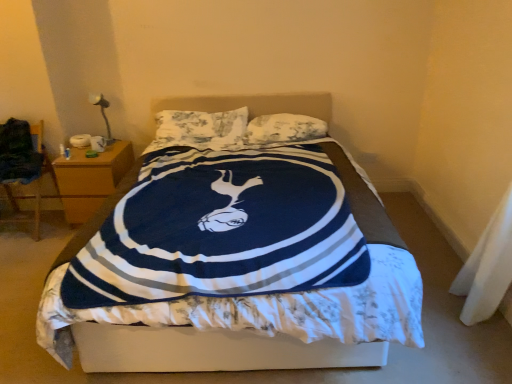
Image resolution: width=512 pixels, height=384 pixels. Identify the location of white fabric at lower right. (487, 267).

Describe the element at coordinates (186, 340) in the screenshot. I see `navy blue plush blanket at center` at that location.

Measure the distance between navy blue plush blanket at center and camera.

navy blue plush blanket at center and camera are 5.38 feet apart from each other.

Locate an element on the screen. metallic silver table lamp at upper left is located at coordinates (102, 113).

Image resolution: width=512 pixels, height=384 pixels. Identify the location of white fabric at lower right. (487, 267).

Is fluffy white pillow at center, which ranks as the second pillow in left-to-right order, in front of fluffy white pillow at center, the second pillow viewed from the right?

No, fluffy white pillow at center, which ranks as the second pillow in left-to-right order, is further to the viewer.

Considering the sizes of objects fluffy white pillow at center, which is the 1th pillow in right-to-left order, and fluffy white pillow at center, placed as the first pillow when sorted from left to right, in the image provided, who is taller, fluffy white pillow at center, which is the 1th pillow in right-to-left order, or fluffy white pillow at center, placed as the first pillow when sorted from left to right,?

fluffy white pillow at center, placed as the first pillow when sorted from left to right, is taller.

Can you confirm if fluffy white pillow at center, which ranks as the second pillow in left-to-right order, is bigger than fluffy white pillow at center, the second pillow viewed from the right?

No.

Does fluffy white pillow at center, which is the 1th pillow in right-to-left order, touch fluffy white pillow at center, placed as the first pillow when sorted from left to right?

No, fluffy white pillow at center, which is the 1th pillow in right-to-left order, is not beside fluffy white pillow at center, placed as the first pillow when sorted from left to right.

Considering the sizes of objects wooden nightstand at left and navy blue plush blanket at center in the image provided, who is thinner, wooden nightstand at left or navy blue plush blanket at center?

Thinner between the two is wooden nightstand at left.

Find the location of a particular element. nightstand that appears above the navy blue plush blanket at center (from the image's perspective) is located at coordinates (90, 179).

Are wooden nightstand at left and navy blue plush blanket at center located far from each other?

Absolutely, wooden nightstand at left is distant from navy blue plush blanket at center.

How many degrees apart are the facing directions of wooden nightstand at left and navy blue plush blanket at center?

They differ by 1.37 degrees in their facing directions.

Locate an element on the screen. The width and height of the screenshot is (512, 384). material that appears below the wooden chair at left (from a real-world perspective) is located at coordinates (487, 267).

From the picture: Is white fabric at lower right outside of wooden chair at left?

Yes, white fabric at lower right is outside of wooden chair at left.

From a real-world perspective, relative to wooden chair at left, is white fabric at lower right vertically above or below?

white fabric at lower right is situated lower than wooden chair at left in the real world.

Can you confirm if white fabric at lower right is positioned to the left of wooden chair at left?

In fact, white fabric at lower right is to the right of wooden chair at left.

Between metallic silver table lamp at upper left and navy blue plush blanket at center, which one appears on the left side from the viewer's perspective?

From the viewer's perspective, metallic silver table lamp at upper left appears more on the left side.

Which of these two, metallic silver table lamp at upper left or navy blue plush blanket at center, is bigger?

Bigger between the two is navy blue plush blanket at center.

Is metallic silver table lamp at upper left positioned with its back to navy blue plush blanket at center?

No, metallic silver table lamp at upper left is not facing away from navy blue plush blanket at center.

From a real-world perspective, is metallic silver table lamp at upper left under navy blue plush blanket at center?

No, from a real-world perspective, metallic silver table lamp at upper left is not below navy blue plush blanket at center.

From a real-world perspective, who is located lower, navy blue plush blanket at center or fluffy white pillow at center, which ranks as the second pillow in left-to-right order?

navy blue plush blanket at center.

Could fluffy white pillow at center, which ranks as the second pillow in left-to-right order, be considered to be inside navy blue plush blanket at center?

Yes, fluffy white pillow at center, which ranks as the second pillow in left-to-right order, is surrounded by navy blue plush blanket at center.

Is navy blue plush blanket at center facing towards fluffy white pillow at center, which ranks as the second pillow in left-to-right order?

No, navy blue plush blanket at center is not facing towards fluffy white pillow at center, which ranks as the second pillow in left-to-right order.

The height and width of the screenshot is (384, 512). I want to click on bed below the fluffy white pillow at center, which is the 1th pillow in right-to-left order (from a real-world perspective), so click(186, 340).

Is point (105, 176) positioned behind point (47, 173)?

No, (105, 176) is closer to viewer.

The height and width of the screenshot is (384, 512). Identify the location of nightstand behind the wooden chair at left. (90, 179).

Between wooden nightstand at left and wooden chair at left, which one has smaller size?

With smaller size is wooden nightstand at left.

Considering the positions of objects wooden nightstand at left and wooden chair at left in the image provided, who is more to the right, wooden nightstand at left or wooden chair at left?

wooden nightstand at left.

Consider the image. Between metallic silver table lamp at upper left and wooden chair at left, which one has more height?

wooden chair at left is taller.

From the image's perspective, does metallic silver table lamp at upper left appear lower than wooden chair at left?

No, from the image's perspective, metallic silver table lamp at upper left is not below wooden chair at left.

Consider the image. Is metallic silver table lamp at upper left inside or outside of wooden chair at left?

metallic silver table lamp at upper left is spatially situated outside wooden chair at left.

Is metallic silver table lamp at upper left beside wooden chair at left?

No, metallic silver table lamp at upper left is not making contact with wooden chair at left.

At what (x,y) coordinates should I click in order to perform the action: click on pillow located underneath the fluffy white pillow at center, placed as the first pillow when sorted from left to right (from a real-world perspective). Please return your answer as a coordinate pair (x, y). The width and height of the screenshot is (512, 384). Looking at the image, I should click on (284, 129).

Locate an element on the screen. bed in front of the wooden nightstand at left is located at coordinates (186, 340).

Based on their spatial positions, is wooden chair at left or wooden nightstand at left further from fluffy white pillow at center, placed as the first pillow when sorted from left to right?

The object further to fluffy white pillow at center, placed as the first pillow when sorted from left to right, is wooden chair at left.

Which object lies nearer to the anchor point fluffy white pillow at center, which ranks as the second pillow in left-to-right order, navy blue plush blanket at center or fluffy white pillow at center, placed as the first pillow when sorted from left to right?

Based on the image, fluffy white pillow at center, placed as the first pillow when sorted from left to right, appears to be nearer to fluffy white pillow at center, which ranks as the second pillow in left-to-right order.

Looking at the image, which one is located further to metallic silver table lamp at upper left, fluffy white pillow at center, which is the 1th pillow in right-to-left order, or wooden nightstand at left?

Based on the image, fluffy white pillow at center, which is the 1th pillow in right-to-left order, appears to be further to metallic silver table lamp at upper left.

Looking at the image, which one is located closer to wooden chair at left, navy blue plush blanket at center or wooden nightstand at left?

Based on the image, wooden nightstand at left appears to be nearer to wooden chair at left.

Considering their positions, is navy blue plush blanket at center positioned further to fluffy white pillow at center, which is the 1th pillow in right-to-left order, than metallic silver table lamp at upper left?

navy blue plush blanket at center lies further to fluffy white pillow at center, which is the 1th pillow in right-to-left order, than the other object.

From the image, which object appears to be farther from fluffy white pillow at center, which ranks as the second pillow in left-to-right order, wooden chair at left or white fabric at lower right?

The object further to fluffy white pillow at center, which ranks as the second pillow in left-to-right order, is wooden chair at left.

Which object lies nearer to the anchor point navy blue plush blanket at center, metallic silver table lamp at upper left or white fabric at lower right?

Result: The object closer to navy blue plush blanket at center is white fabric at lower right.

From the image, which object appears to be nearer to fluffy white pillow at center, the second pillow viewed from the right, fluffy white pillow at center, which is the 1th pillow in right-to-left order, or wooden chair at left?

Based on the image, fluffy white pillow at center, which is the 1th pillow in right-to-left order, appears to be nearer to fluffy white pillow at center, the second pillow viewed from the right.

This screenshot has height=384, width=512. I want to click on chair between navy blue plush blanket at center and metallic silver table lamp at upper left from front to back, so click(x=31, y=183).

Locate an element on the screen. The image size is (512, 384). nightstand between navy blue plush blanket at center and metallic silver table lamp at upper left along the z-axis is located at coordinates (90, 179).

Locate an element on the screen. The height and width of the screenshot is (384, 512). table lamp situated between wooden chair at left and fluffy white pillow at center, which is the 1th pillow in right-to-left order, from left to right is located at coordinates pos(102,113).

This screenshot has height=384, width=512. I want to click on table lamp located between wooden chair at left and fluffy white pillow at center, placed as the first pillow when sorted from left to right, in the left-right direction, so click(x=102, y=113).